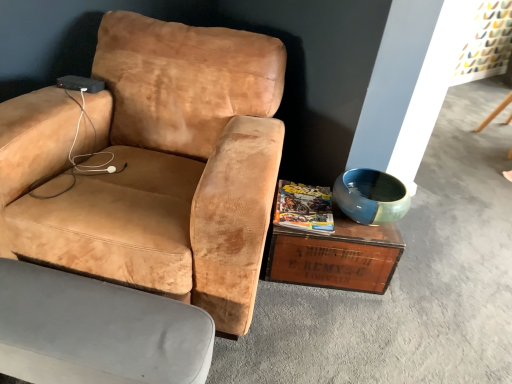
At what (x,y) coordinates should I click in order to perform the action: click on free spot to the right of wooden crate at lower right. Please return your answer as a coordinate pair (x, y). Looking at the image, I should click on (422, 289).